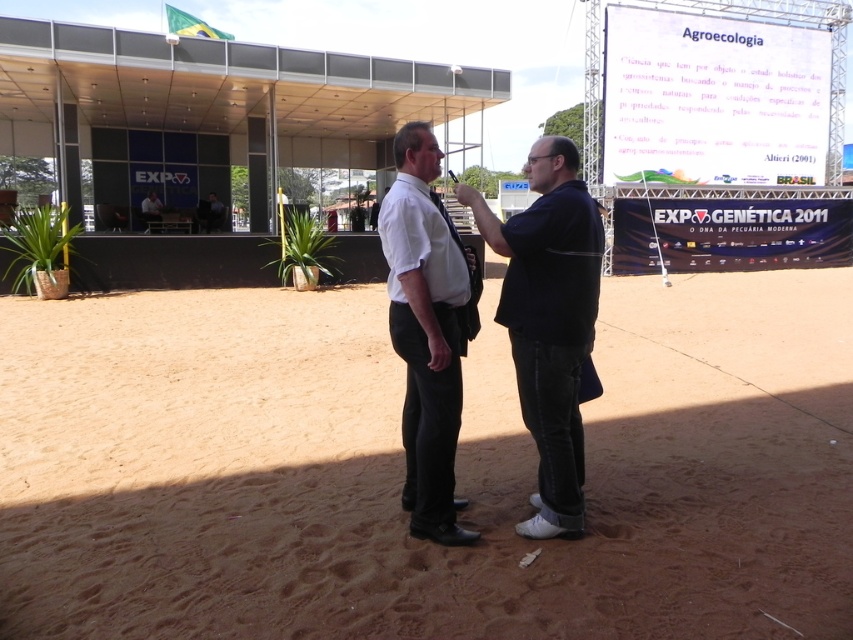
Does brown sandy ground at center come in front of dark blue shirt at center?

Yes, it is.

Who is more forward, [648,492] or [521,257]?

Point [521,257] is in front.

Between point (606, 348) and point (532, 433), which one is positioned in front?

Positioned in front is point (532, 433).

This screenshot has height=640, width=853. Identify the location of brown sandy ground at center. (402, 472).

Is dark blue shirt at center positioned at the back of white shirt at center?

Yes, it is behind white shirt at center.

Identify the location of dark blue shirt at center. (548, 321).

Does brown sandy ground at center come in front of white shirt at center?

Yes, it is in front of white shirt at center.

Is point (177, 502) farther from camera compared to point (427, 161)?

Yes, point (177, 502) is behind point (427, 161).

The image size is (853, 640). What are the coordinates of `brown sandy ground at center` in the screenshot? It's located at (402, 472).